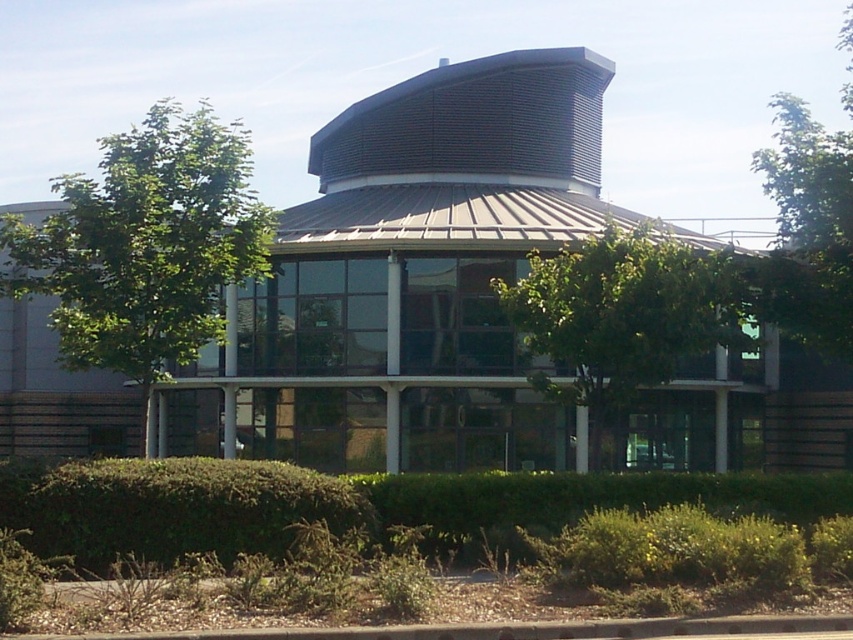
Question: Does green leafy bush at lower center appear on the left side of green leafy tree at upper right?

Choices:
 (A) yes
 (B) no

Answer: (A)

Question: Which is nearer to the green leafy bush at lower center?

Choices:
 (A) green leafy tree at center
 (B) green leafy tree at left
 (C) green leafy tree at upper right

Answer: (A)

Question: Considering the relative positions of green leafy tree at center and green leafy tree at upper right in the image provided, where is green leafy tree at center located with respect to green leafy tree at upper right?

Choices:
 (A) left
 (B) right

Answer: (A)

Question: Which of the following is the closest to the observer?

Choices:
 (A) green leafy tree at upper right
 (B) green leafy tree at left
 (C) green leafy bush at lower center

Answer: (C)

Question: Does green leafy tree at left appear over green leafy tree at center?

Choices:
 (A) no
 (B) yes

Answer: (B)

Question: Which point is farther to the camera?

Choices:
 (A) (844, 44)
 (B) (683, 259)
 (C) (204, 243)
 (D) (123, 460)

Answer: (A)